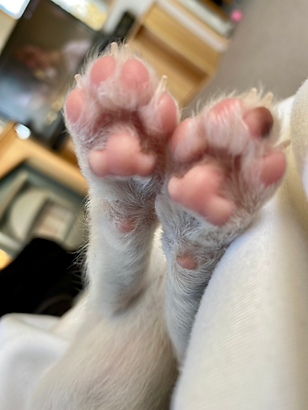
Locate an element on the screen. The height and width of the screenshot is (410, 308). fireplace is located at coordinates (52, 217).